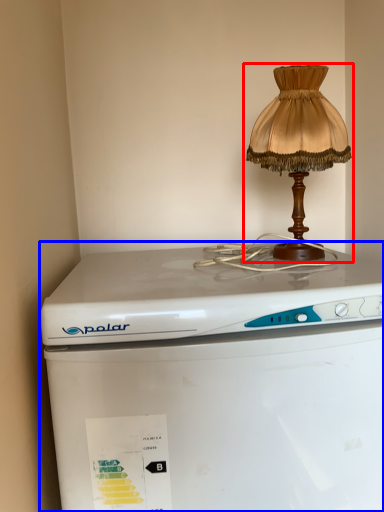
Question: Which point is further to the camera, lamp (highlighted by a red box) or home appliance (highlighted by a blue box)?

Choices:
 (A) lamp
 (B) home appliance

Answer: (A)